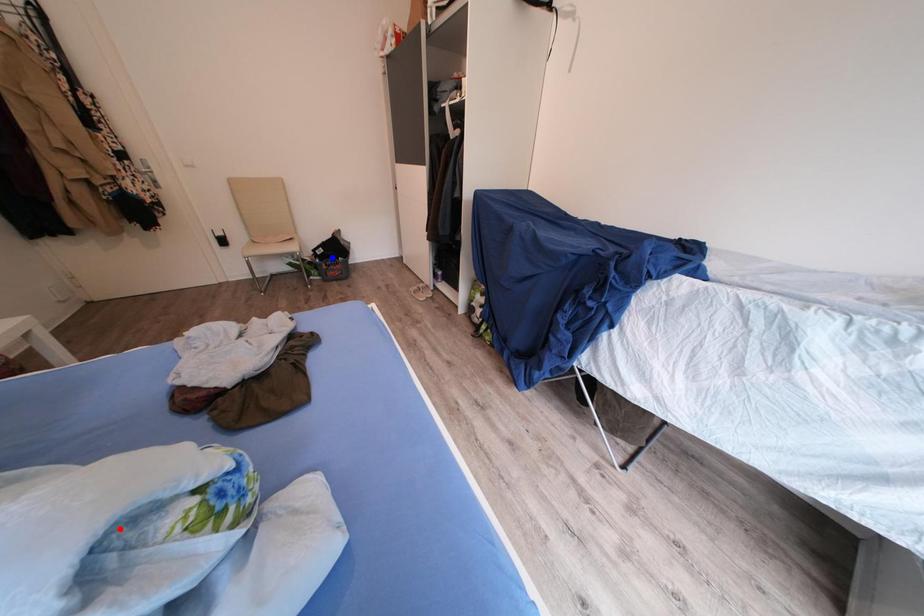
Question: In the image, two points are highlighted. Which point is nearer to the camera? Reply with the corresponding letter.

Choices:
 (A) blue point
 (B) red point

Answer: (B)